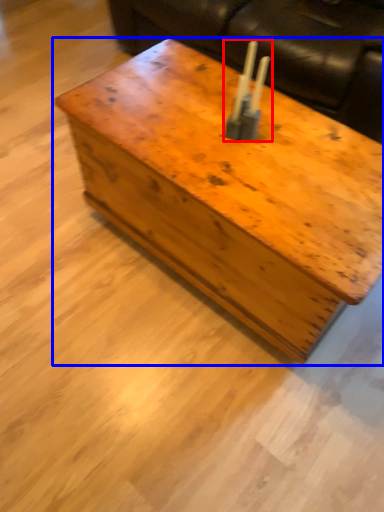
Question: Which object appears farthest to the camera in this image, candle holder (highlighted by a red box) or table (highlighted by a blue box)?

Choices:
 (A) candle holder
 (B) table

Answer: (A)